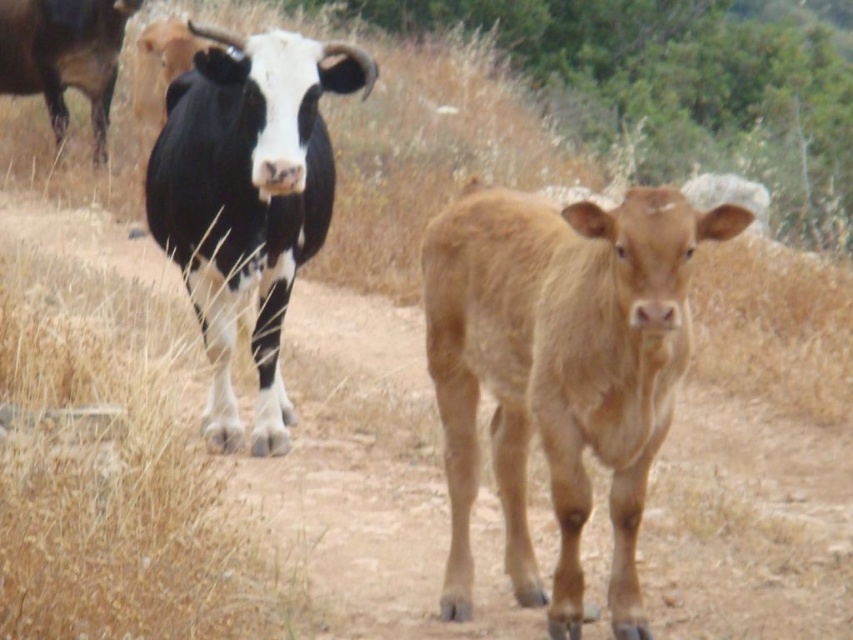
From the picture: Is brown smooth calf at center above black and white fur at center?

No.

Who is more forward, (x=442, y=225) or (x=276, y=310)?

Point (x=442, y=225)

At what (x,y) coordinates should I click in order to perform the action: click on brown smooth calf at center. Please return your answer as a coordinate pair (x, y). Looking at the image, I should click on (560, 369).

Is black and white fur at center below black glossy cow at upper left?

Indeed, black and white fur at center is positioned under black glossy cow at upper left.

Who is positioned more to the right, black and white fur at center or black glossy cow at upper left?

From the viewer's perspective, black and white fur at center appears more on the right side.

Locate an element on the screen. Image resolution: width=853 pixels, height=640 pixels. black and white fur at center is located at coordinates (247, 198).

Does brown smooth calf at center have a lesser width compared to black glossy cow at upper left?

Yes.

The image size is (853, 640). What do you see at coordinates (560, 369) in the screenshot?
I see `brown smooth calf at center` at bounding box center [560, 369].

Identify the location of brown smooth calf at center. The width and height of the screenshot is (853, 640). (560, 369).